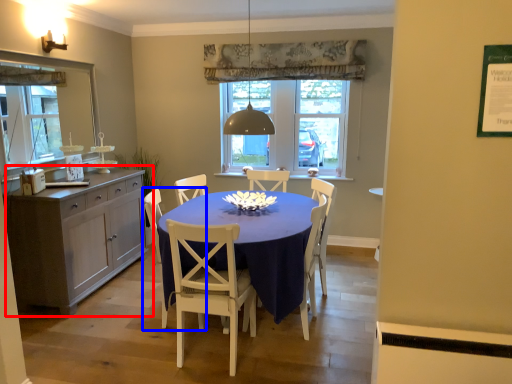
Question: Among these objects, which one is farthest to the camera, cabinetry (highlighted by a red box) or chair (highlighted by a blue box)?

Choices:
 (A) cabinetry
 (B) chair

Answer: (A)